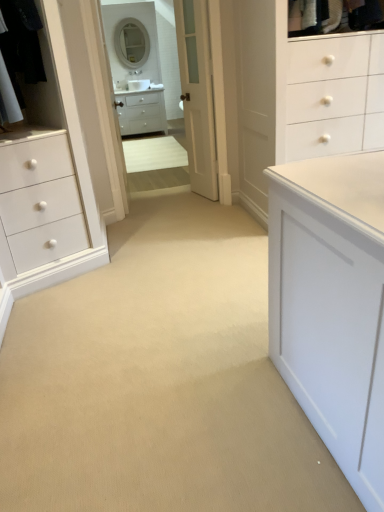
Question: Considering the relative positions of black fabric laundry at upper left and white wood door at center in the image provided, is black fabric laundry at upper left to the left of white wood door at center from the viewer's perspective?

Choices:
 (A) yes
 (B) no

Answer: (A)

Question: Could you tell me if black fabric laundry at upper left is facing white wood door at center?

Choices:
 (A) yes
 (B) no

Answer: (B)

Question: Can you confirm if black fabric laundry at upper left is thinner than white wood door at center?

Choices:
 (A) no
 (B) yes

Answer: (A)

Question: Does black fabric laundry at upper left have a lesser height compared to white wood door at center?

Choices:
 (A) no
 (B) yes

Answer: (B)

Question: Is black fabric laundry at upper left at the right side of white wood door at center?

Choices:
 (A) yes
 (B) no

Answer: (B)

Question: Is white glossy mirror at upper center, the second mirror in the top-to-bottom sequence, to the left or to the right of white glossy mirror at upper center, which appears as the first mirror when viewed from the top, in the image?

Choices:
 (A) right
 (B) left

Answer: (A)

Question: From a real-world perspective, is white glossy mirror at upper center, the second mirror in the top-to-bottom sequence, above or below white glossy mirror at upper center, which is the second mirror in bottom-to-top order?

Choices:
 (A) above
 (B) below

Answer: (B)

Question: Is white glossy mirror at upper center, which is the 1th mirror from bottom to top, inside the boundaries of white glossy mirror at upper center, which appears as the first mirror when viewed from the top, or outside?

Choices:
 (A) outside
 (B) inside

Answer: (A)

Question: Is point (125, 76) positioned closer to the camera than point (125, 60)?

Choices:
 (A) farther
 (B) closer

Answer: (B)

Question: Is black fabric laundry at upper left taller or shorter than white glossy mirror at upper center, which appears as the first mirror when viewed from the top?

Choices:
 (A) tall
 (B) short

Answer: (B)

Question: From a real-world perspective, is black fabric laundry at upper left physically located above or below white glossy mirror at upper center, which appears as the first mirror when viewed from the top?

Choices:
 (A) below
 (B) above

Answer: (A)

Question: From the image's perspective, is black fabric laundry at upper left located above or below white glossy mirror at upper center, which is the second mirror in bottom-to-top order?

Choices:
 (A) above
 (B) below

Answer: (B)

Question: Is black fabric laundry at upper left situated inside white glossy mirror at upper center, which appears as the first mirror when viewed from the top, or outside?

Choices:
 (A) inside
 (B) outside

Answer: (B)

Question: Looking at their shapes, would you say white glossy medicine cabinet at upper center is wider or thinner than black fabric laundry at upper left?

Choices:
 (A) wide
 (B) thin

Answer: (B)

Question: Does point (177, 24) appear closer or farther from the camera than point (41, 62)?

Choices:
 (A) closer
 (B) farther

Answer: (B)